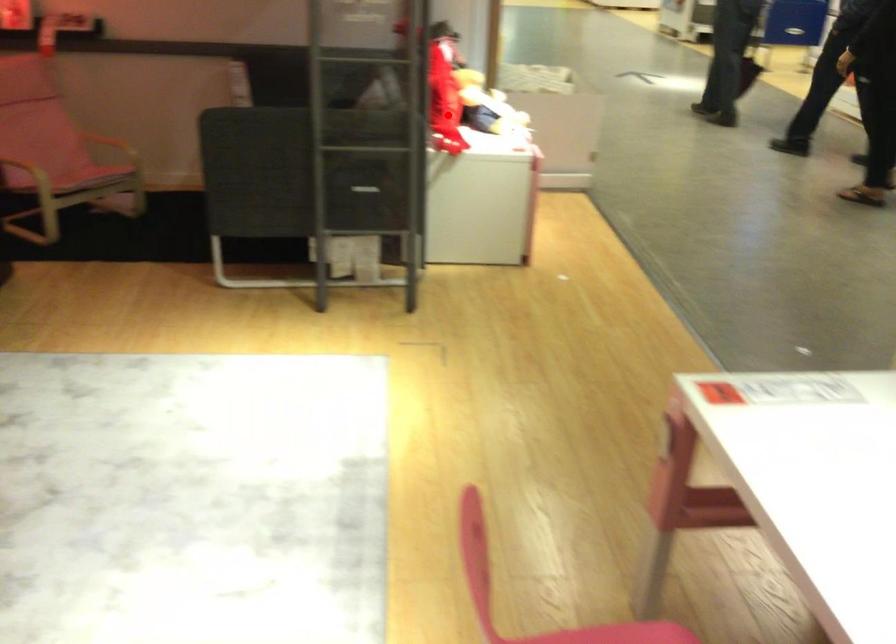
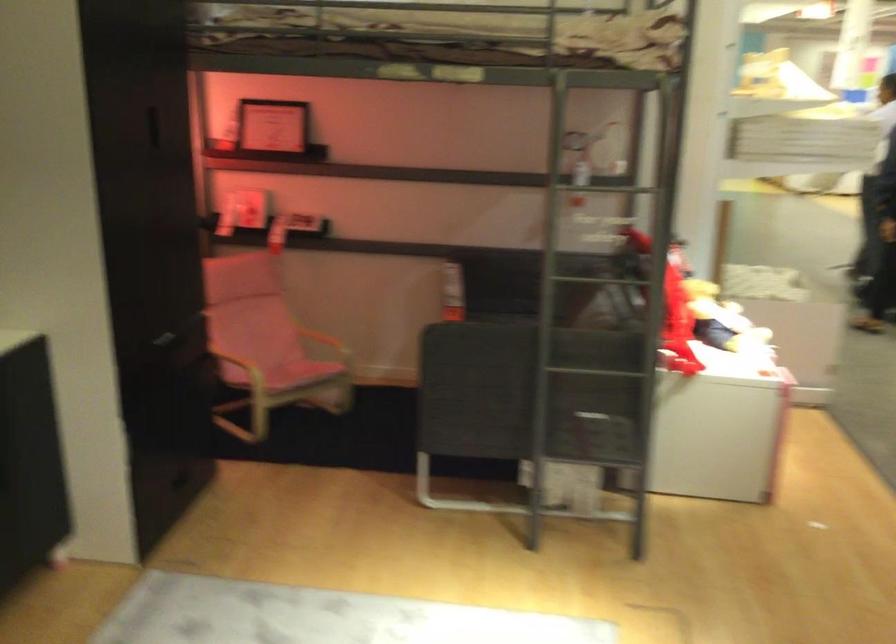
Find the pixel in the second image that matches the highlighted location in the first image.

(677, 325)